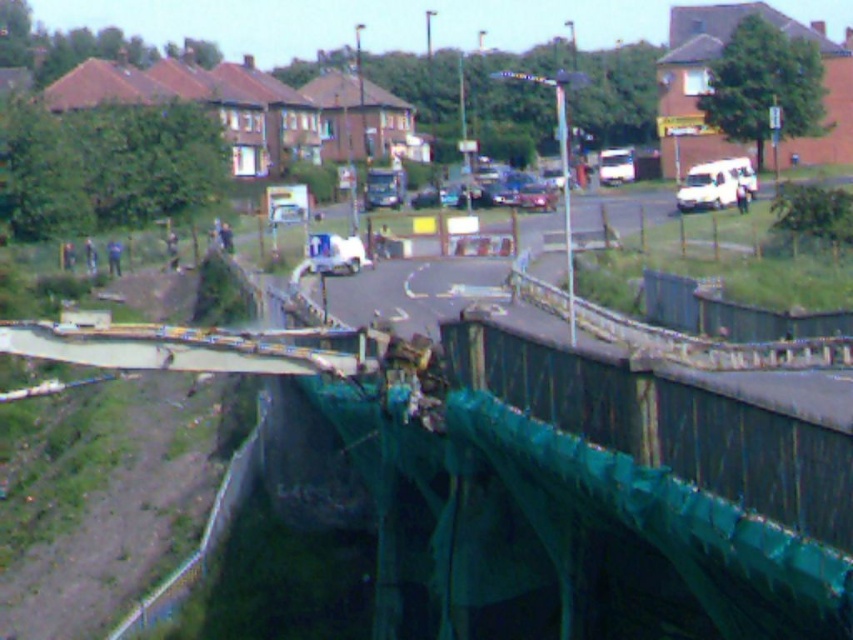
You are a driver approaching the collapsed bridge. You see the metallic gray bridge at center and the shiny silver car at center. Which object is shorter in height?

The metallic gray bridge at center is not as tall as the shiny silver car at center, so the metallic gray bridge at center is shorter in height.

You are a delivery driver who needs to cross the collapsed bridge. There is a point marked at coordinates (183,348) on the metallic gray bridge at center. Can you safely drive your truck over the bridge at that point?

The point at coordinates (183,348) is on the metallic gray bridge at center, but the bridge is collapsed and shows significant damage and instability. Therefore, it is unsafe to drive a truck over the bridge at that point.